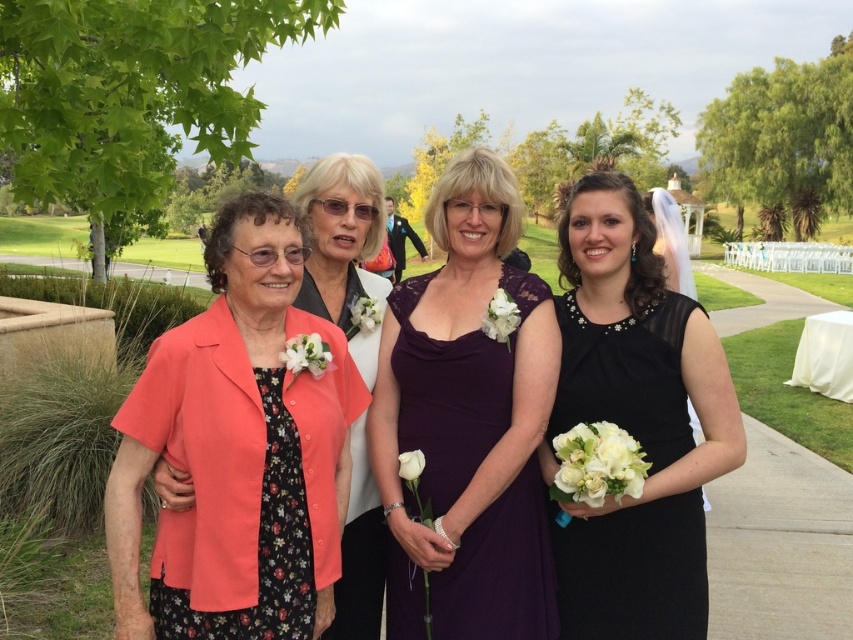
Is the position of matte coral cardigan at left less distant than that of purple lace dress at center?

Yes, it is in front of purple lace dress at center.

Can you confirm if matte coral cardigan at left is positioned to the left of purple lace dress at center?

Indeed, matte coral cardigan at left is positioned on the left side of purple lace dress at center.

At what (x,y) coordinates should I click in order to perform the action: click on matte coral cardigan at left. Please return your answer as a coordinate pair (x, y). Looking at the image, I should click on (238, 451).

This screenshot has width=853, height=640. I want to click on matte coral cardigan at left, so click(238, 451).

Can you confirm if matte coral cardigan at left is taller than black satin dress at right?

Correct, matte coral cardigan at left is much taller as black satin dress at right.

Which is above, matte coral cardigan at left or black satin dress at right?

matte coral cardigan at left

Is point (248, 344) behind point (672, 445)?

No, it is in front of (672, 445).

Where is `matte coral cardigan at left`? matte coral cardigan at left is located at coordinates (238, 451).

Who is more forward, (659, 602) or (437, 403)?

Point (659, 602) is more forward.

Between point (653, 577) and point (413, 432), which one is positioned behind?

Positioned behind is point (413, 432).

Find the location of a particular element. black satin dress at right is located at coordinates (633, 572).